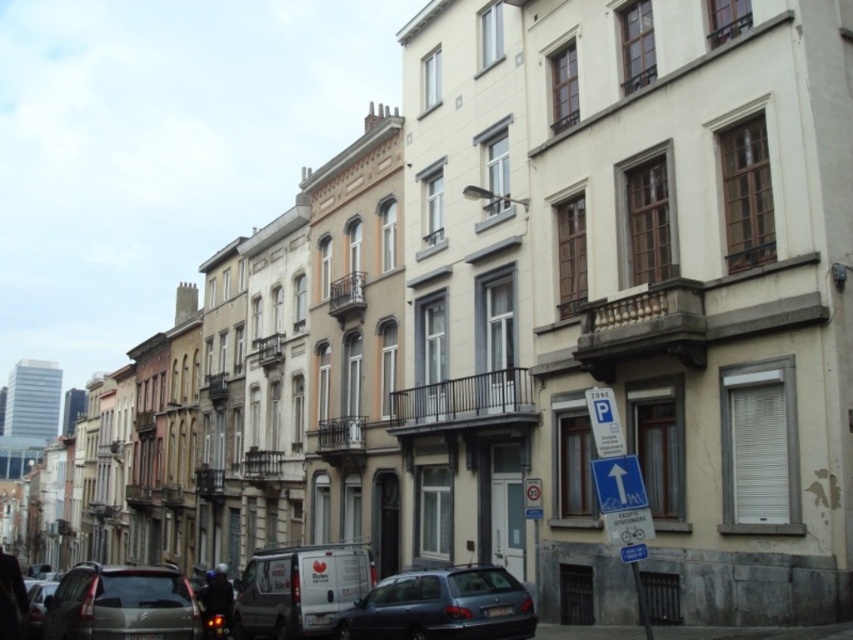
You are a delivery driver who needs to park your vehicle in this area. You see the blue plastic parking sign at lower right and the shiny silver car at lower left. Which object is shorter in height?

The blue plastic parking sign at lower right is not as tall as the shiny silver car at lower left, so the blue plastic parking sign at lower right is shorter in height.

You are a delivery person trying to park your vehicle in this street. You see the metallic gray hatchback at lower center and the shiny silver car at lower left. Which vehicle should you avoid parking between to ensure enough space?

You should avoid parking between the shiny silver car at lower left and the metallic gray hatchback at lower center because the metallic gray hatchback at lower center is positioned to the right of the shiny silver car at lower left, leaving limited space between them.

You are a delivery driver who needs to park your vehicle in this street scene. You see a metallic gray hatchback at lower center and a blue plastic parking sign at lower right. Based on their positions, which object is closer to the ground?

The metallic gray hatchback at lower center is located below the blue plastic parking sign at lower right, so the metallic gray hatchback at lower center is closer to the ground.